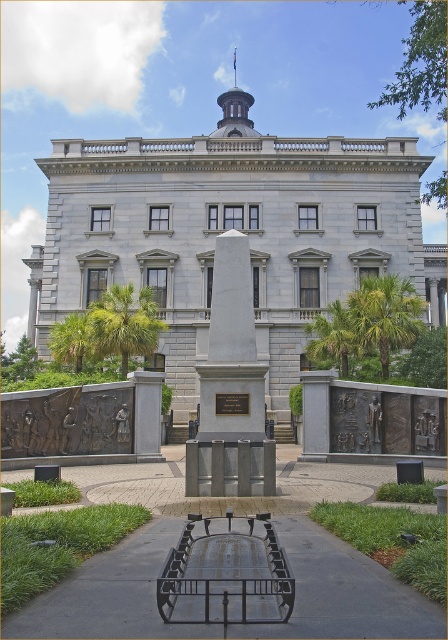
You are standing in front of the grand neoclassical building and want to take a photo. You notice two points marked in the scene. The first point is at coordinate point [182,604] and the second is at point [216,276]. Which point is closer to your camera lens?

Point [182,604] is closer to the camera than point [216,276], so the first point is closer to your camera lens.

You are a gardener tasked with placing a new flower pot that is 1 meter wide between the metallic park bench at center and the white marble obelisk at center. Can you fit the flower pot between them without moving either object?

The metallic park bench at center is thinner than the white marble obelisk at center, but the width of the flower pot is 1 meter. Since the description does not provide the exact distance between the two objects, it is impossible to determine if the flower pot will fit without additional information.